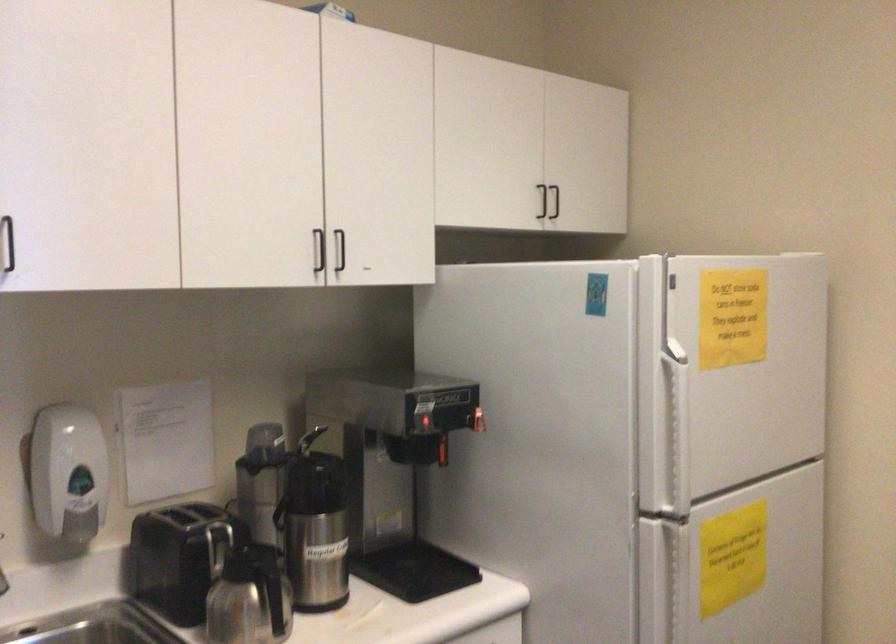
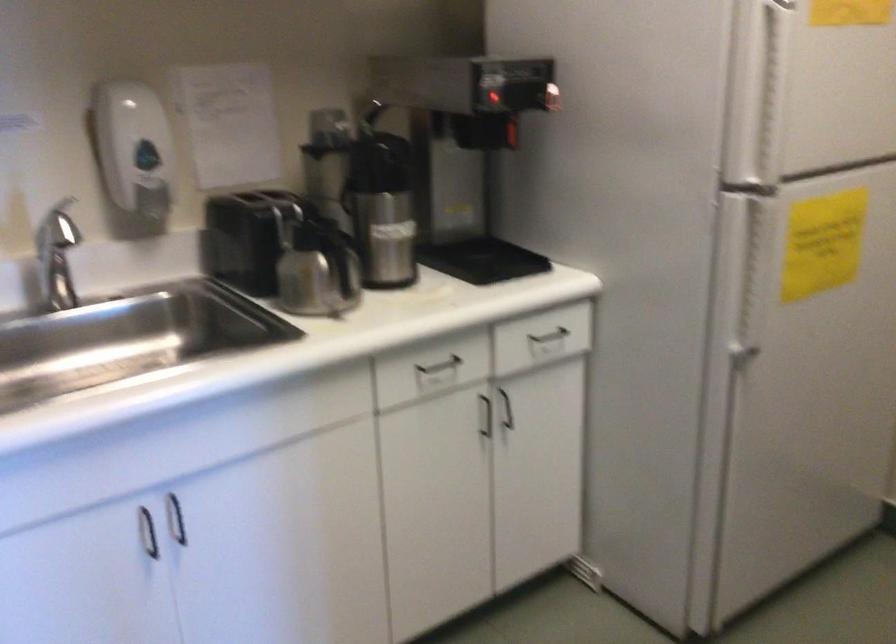
Question: Based on the continuous images, in which direction is the camera rotating? Reply with the corresponding letter.

Choices:
 (A) Left
 (B) Right
 (C) Up
 (D) Down

Answer: (D)